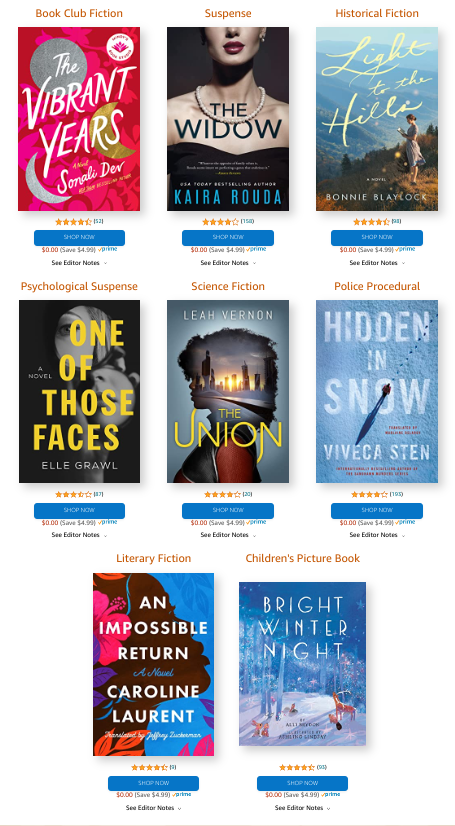
Where is `books`? books is located at coordinates (180, 661), (277, 657), (355, 411), (277, 400), (105, 392), (113, 68), (218, 76), (351, 88).